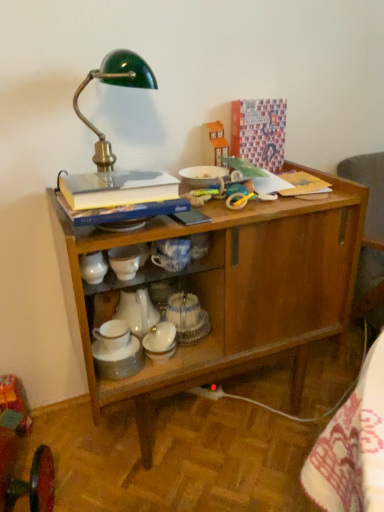
Question: Can you confirm if white porcelain teapot at center is thinner than green enameled metal desk lamp at upper left?

Choices:
 (A) no
 (B) yes

Answer: (B)

Question: Is white porcelain teapot at center positioned with its back to green enameled metal desk lamp at upper left?

Choices:
 (A) yes
 (B) no

Answer: (B)

Question: Is white porcelain teapot at center further to camera compared to green enameled metal desk lamp at upper left?

Choices:
 (A) yes
 (B) no

Answer: (A)

Question: From the image's perspective, is white porcelain teapot at center located above green enameled metal desk lamp at upper left?

Choices:
 (A) no
 (B) yes

Answer: (A)

Question: Is white porcelain teapot at center taller than green enameled metal desk lamp at upper left?

Choices:
 (A) no
 (B) yes

Answer: (A)

Question: From the image's perspective, does white porcelain teapot at center appear lower than green enameled metal desk lamp at upper left?

Choices:
 (A) no
 (B) yes

Answer: (B)

Question: From a real-world perspective, is hardcover book at upper left physically below green enameled metal desk lamp at upper left?

Choices:
 (A) no
 (B) yes

Answer: (B)

Question: Is green enameled metal desk lamp at upper left at the back of hardcover book at upper left?

Choices:
 (A) yes
 (B) no

Answer: (A)

Question: From the image's perspective, would you say hardcover book at upper left is positioned over green enameled metal desk lamp at upper left?

Choices:
 (A) yes
 (B) no

Answer: (B)

Question: Is hardcover book at upper left with green enameled metal desk lamp at upper left?

Choices:
 (A) no
 (B) yes

Answer: (A)

Question: Would you say hardcover book at upper left is a long distance from green enameled metal desk lamp at upper left?

Choices:
 (A) yes
 (B) no

Answer: (B)

Question: Is hardcover book at upper left behind green enameled metal desk lamp at upper left?

Choices:
 (A) no
 (B) yes

Answer: (A)

Question: Does green enameled metal desk lamp at upper left have a smaller size compared to wooden cabinet at center?

Choices:
 (A) no
 (B) yes

Answer: (B)